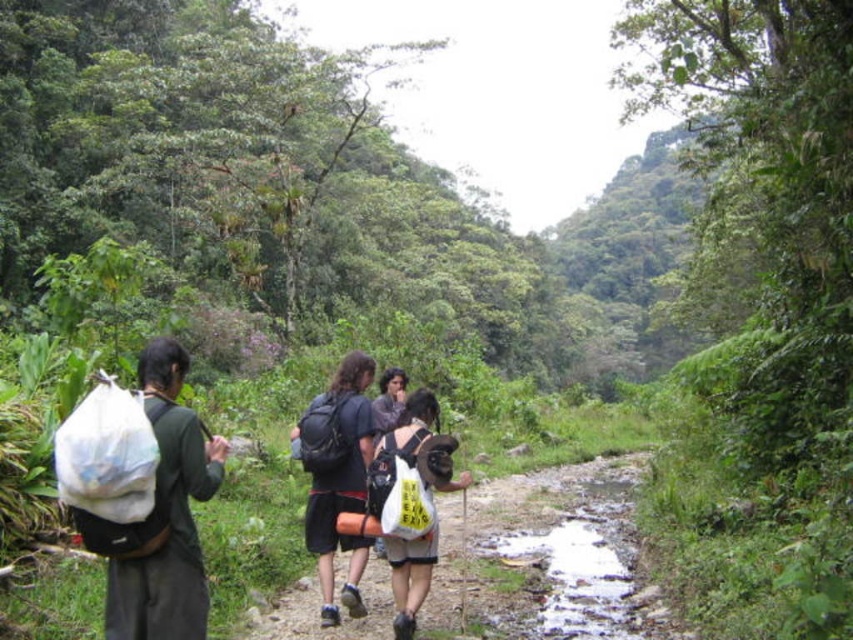
You are a hiker planning to carry both the black backpack at center and the white fabric bag at center. Given their sizes, which one should you place first into your storage compartment to ensure both fit?

The black backpack at center is wider than the white fabric bag at center. Therefore, you should place the wider black backpack at center first into your storage compartment to accommodate its larger size before fitting the narrower white fabric bag at center.

You are a hiker trying to decide which item to grab first from the center of your path. The black backpack at center and the white fabric bag at center are both in your way. Which one is easier to reach without bending down?

The black backpack at center is above the white fabric bag at center, so it is easier to reach without bending down.